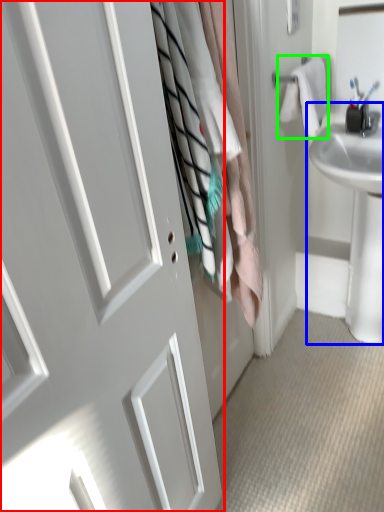
Question: Based on their relative distances, which object is farther from door (highlighted by a red box)? Choose from sink (highlighted by a blue box) and bath towel (highlighted by a green box).

Choices:
 (A) sink
 (B) bath towel

Answer: (A)